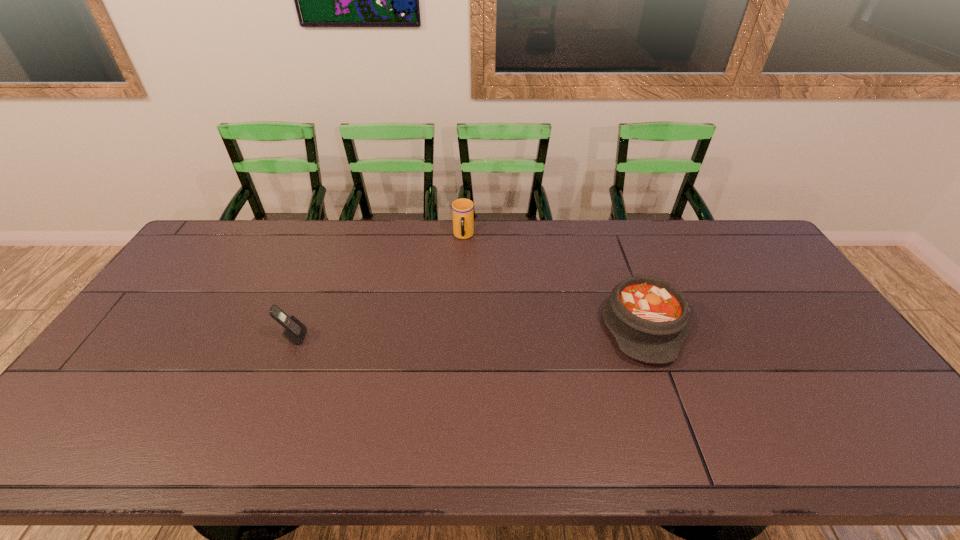
The width and height of the screenshot is (960, 540). I want to click on vacant space at the left edge of the desktop, so click(118, 384).

Where is `free space at the right edge of the desktop`? free space at the right edge of the desktop is located at coordinates (734, 272).

At what (x,y) coordinates should I click in order to perform the action: click on free location at the far left corner of the desktop. Please return your answer as a coordinate pair (x, y). Looking at the image, I should click on (233, 247).

The width and height of the screenshot is (960, 540). What are the coordinates of `free point at the near right corner` in the screenshot? It's located at pos(885,463).

Locate an element on the screen. This screenshot has height=540, width=960. free area in between the farthest object and the leftmost object is located at coordinates (378, 287).

At what (x,y) coordinates should I click in order to perform the action: click on vacant space in between the cellular telephone and the casserole. Please return your answer as a coordinate pair (x, y). The height and width of the screenshot is (540, 960). Looking at the image, I should click on (468, 331).

I want to click on free space between the leftmost object and the cup, so click(x=378, y=287).

Identify the location of unoccupied area between the rightmost object and the cup. (553, 280).

Image resolution: width=960 pixels, height=540 pixels. I want to click on free space between the second object from left to right and the leftmost object, so click(x=378, y=287).

At what (x,y) coordinates should I click in order to perform the action: click on free space between the cellular telephone and the casserole. Please return your answer as a coordinate pair (x, y). Looking at the image, I should click on (468, 331).